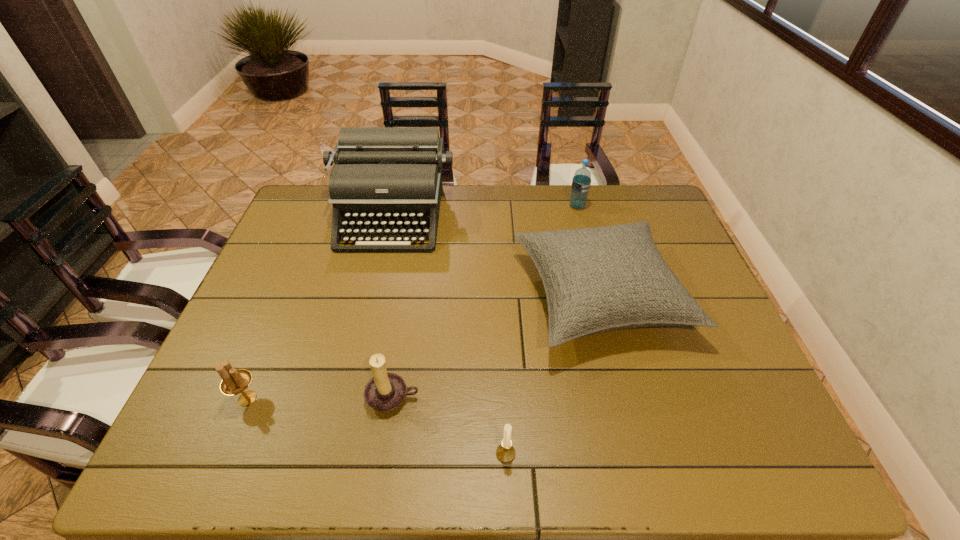
You are a GUI agent. You are given a task and a screenshot of the screen. Output one action in this format:
    pyautogui.click(x=<x>, y=<y>)
    Task: Click on the vacant area at the far edge of the desktop
    The height and width of the screenshot is (540, 960).
    Given the screenshot: What is the action you would take?
    pyautogui.click(x=605, y=202)

In the image, there is a desktop. Where is `blank space at the near edge`? blank space at the near edge is located at coordinates (571, 436).

I want to click on vacant space at the left edge of the desktop, so click(x=242, y=336).

You are a GUI agent. You are given a task and a screenshot of the screen. Output one action in this format:
    pyautogui.click(x=<x>, y=<y>)
    Task: Click on the blank space at the right edge of the desktop
    This screenshot has width=960, height=540.
    Given the screenshot: What is the action you would take?
    pyautogui.click(x=762, y=406)

The width and height of the screenshot is (960, 540). In order to click on free space at the far left corner of the desktop in this screenshot , I will do `click(300, 207)`.

The width and height of the screenshot is (960, 540). I want to click on vacant space at the far right corner, so click(621, 200).

Identify the location of free space between the cushion and the typewriter. (495, 256).

Where is `blank region between the cushion and the second candle holder from right to left`? This screenshot has height=540, width=960. blank region between the cushion and the second candle holder from right to left is located at coordinates pyautogui.click(x=496, y=347).

Where is `free space that is in between the rightmost candle holder and the water bottle`? free space that is in between the rightmost candle holder and the water bottle is located at coordinates (541, 330).

Locate an element on the screen. The width and height of the screenshot is (960, 540). free spot between the second candle holder from left to right and the cushion is located at coordinates (496, 347).